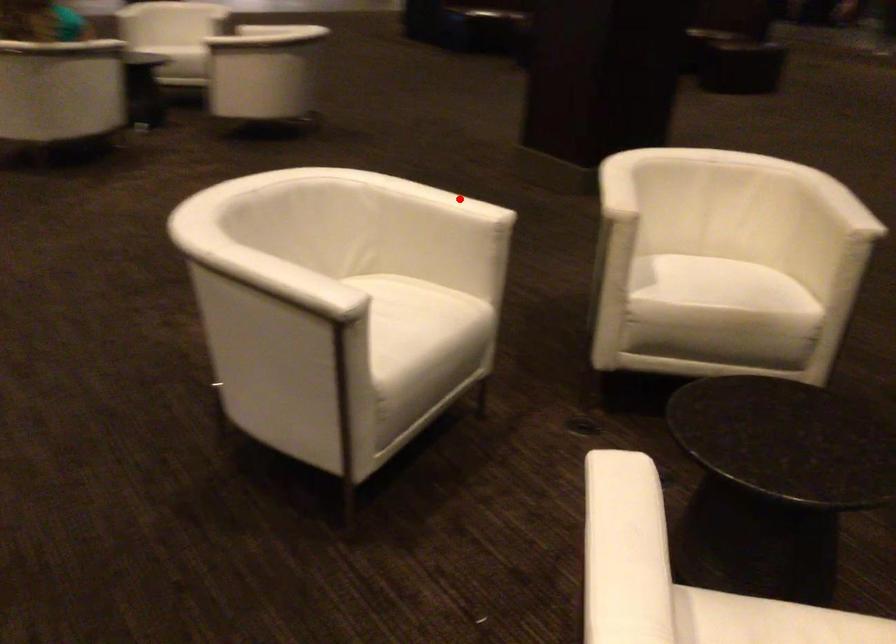
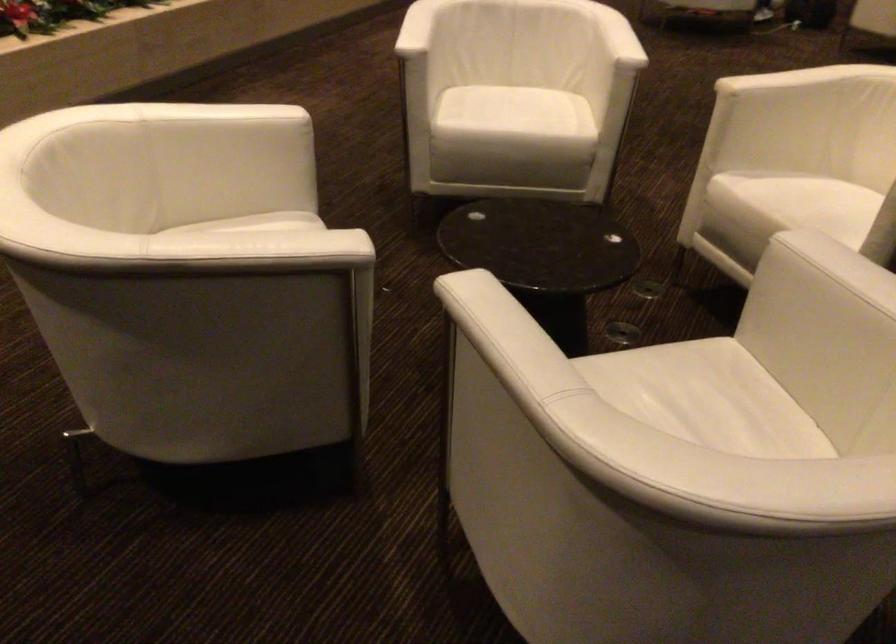
Question: I am providing you with two images of the same scene from different viewpoints. A red point is shown in image1. For the corresponding object point in image2, is it positioned nearer or farther from the camera?

Choices:
 (A) Nearer
 (B) Farther

Answer: (B)